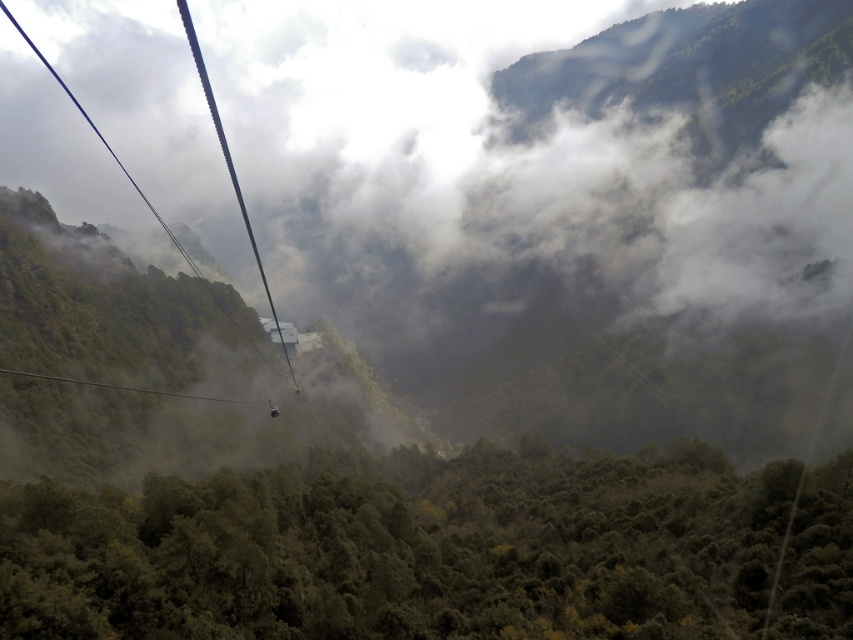
Question: Which of these objects is positioned closest to the white fluffy fog at center?

Choices:
 (A) metallic cable car at center
 (B) white plastic ski lift at left
 (C) green matte forest at lower center

Answer: (B)

Question: Is green matte forest at lower center below metallic cable car at center?

Choices:
 (A) no
 (B) yes

Answer: (B)

Question: Which is nearer to the metallic cable car at center?

Choices:
 (A) white plastic ski lift at left
 (B) white fluffy fog at center
 (C) green matte forest at lower center

Answer: (C)

Question: Which of these objects is positioned closest to the white fluffy fog at center?

Choices:
 (A) metallic cable car at center
 (B) white plastic ski lift at left
 (C) green matte forest at lower center

Answer: (B)

Question: Can you confirm if white fluffy fog at center is positioned to the left of green matte forest at lower center?

Choices:
 (A) yes
 (B) no

Answer: (A)

Question: Is white fluffy fog at center bigger than metallic cable car at center?

Choices:
 (A) no
 (B) yes

Answer: (B)